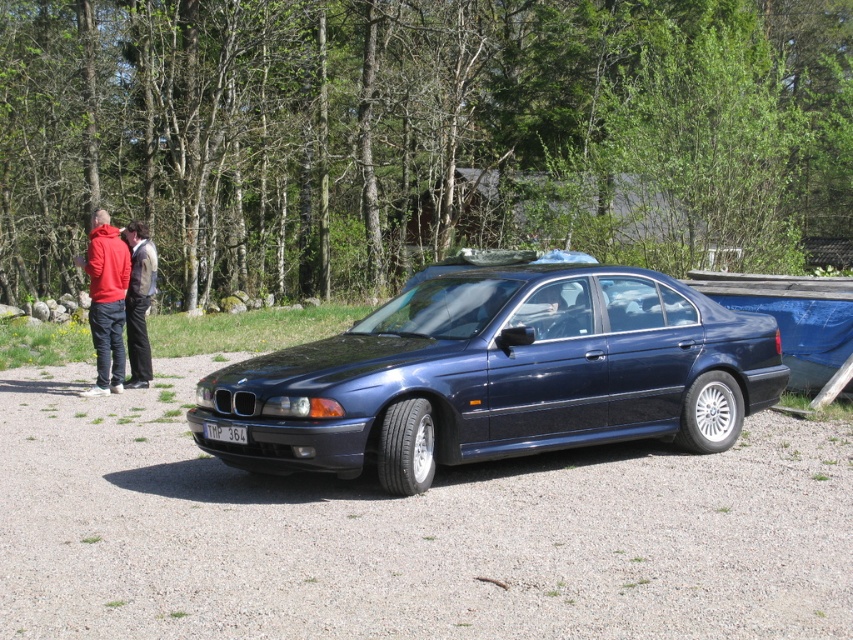
Can you confirm if glossy metallic car at center is positioned to the left of matte red hoodie at left?

Incorrect, glossy metallic car at center is not on the left side of matte red hoodie at left.

What do you see at coordinates (498, 376) in the screenshot?
I see `glossy metallic car at center` at bounding box center [498, 376].

Which is behind, point (440, 358) or point (109, 355)?

Positioned behind is point (109, 355).

Where is `glossy metallic car at center`? The height and width of the screenshot is (640, 853). glossy metallic car at center is located at coordinates (498, 376).

Does point (416, 468) come closer to viewer compared to point (231, 440)?

Yes, it is.

Who is higher up, glossy metallic car at center or white plastic license plate at center?

glossy metallic car at center is above.

Which is behind, point (674, 424) or point (207, 428)?

The point (674, 424) is more distant.

Where is `glossy metallic car at center`? glossy metallic car at center is located at coordinates (498, 376).

Does matte red hoodie at left appear on the left side of dark blue leather jacket at left?

Indeed, matte red hoodie at left is positioned on the left side of dark blue leather jacket at left.

Measure the distance between point [105,250] and camera.

A distance of 10.75 meters exists between point [105,250] and camera.

You are a GUI agent. You are given a task and a screenshot of the screen. Output one action in this format:
    pyautogui.click(x=<x>, y=<y>)
    Task: Click on the matte red hoodie at left
    This screenshot has width=853, height=640.
    Given the screenshot: What is the action you would take?
    pyautogui.click(x=106, y=301)